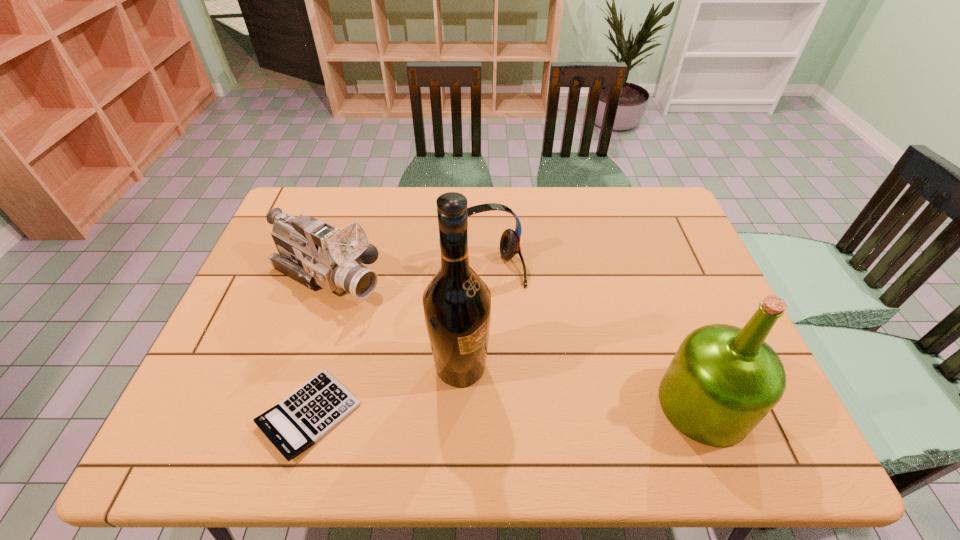
Where is `vacant area situated with the microphone attached to the side of the headset`? vacant area situated with the microphone attached to the side of the headset is located at coordinates tap(554, 399).

Locate an element on the screen. blank space located 0.100m with the microphone attached to the side of the headset is located at coordinates coord(511,314).

Locate an element on the screen. Image resolution: width=960 pixels, height=540 pixels. free space located with the microphone attached to the side of the headset is located at coordinates (504, 300).

Find the location of `vacant space located 0.130m on the label of the tallest object`. vacant space located 0.130m on the label of the tallest object is located at coordinates (536, 407).

At what (x,y) coordinates should I click in order to perform the action: click on calculator present at the near edge. Please return your answer as a coordinate pair (x, y). Looking at the image, I should click on (299, 421).

In order to click on olive oil present at the near edge in this screenshot , I will do `click(723, 380)`.

Find the location of `wine bottle at the near edge`. wine bottle at the near edge is located at coordinates (457, 303).

Locate an element on the screen. object at the left edge is located at coordinates (314, 253).

Find the location of a particular element. Image resolution: width=960 pixels, height=540 pixels. object present at the right edge is located at coordinates (723, 380).

Image resolution: width=960 pixels, height=540 pixels. I want to click on object present at the near right corner, so click(x=723, y=380).